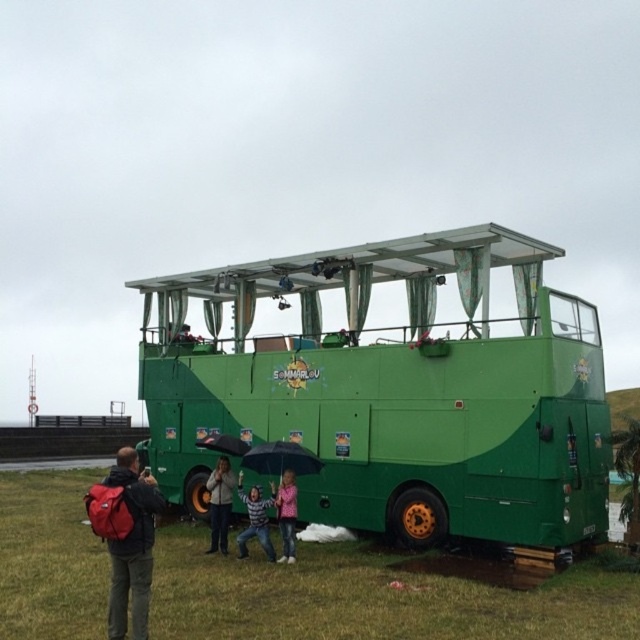
You are a traveler who just arrived at the bus station and need to place your red backpack at lower left and matte gray hoodie at center into the bus. The bus has a narrow entrance that can only accommodate items up to 2.5 meters apart. Can you carry both items through the entrance without dropping anything?

The red backpack at lower left and matte gray hoodie at center are 2.55 meters apart, which exceeds the entrance limit of 2.5 meters. Therefore, you cannot carry both items through the entrance without dropping something.

You are a photographer trying to capture both the pink fabric jacket at center and the black matte umbrella at lower center in a single frame. Given their sizes, which object should you focus on to ensure both fit well in the photo?

Since the pink fabric jacket at center is larger than the black matte umbrella at lower center, you should focus on the pink fabric jacket at center to ensure both objects fit well in the photo.

You are standing in front of the double decker bus and see the green grass at lower left and the red backpack at lower left. Which object is closer to the ground?

The green grass at lower left is shorter than the red backpack at lower left, so the green grass at lower left is closer to the ground.